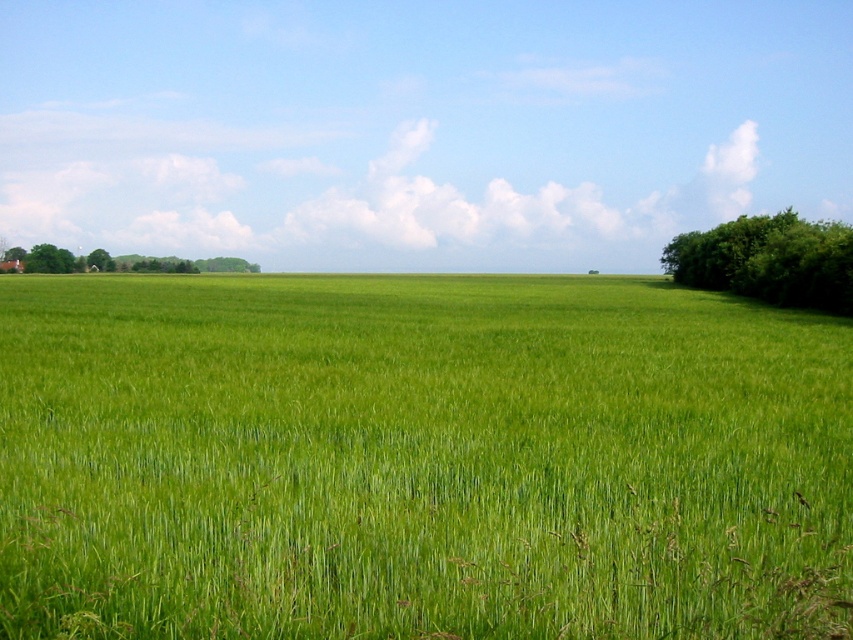
Question: Which point appears farthest from the camera in this image?

Choices:
 (A) (762, 253)
 (B) (242, 388)
 (C) (99, 266)
 (D) (44, 268)

Answer: (C)

Question: Which point is farther to the camera?

Choices:
 (A) green grassy field at center
 (B) green leafy tree at left

Answer: (A)

Question: Is green grass at center thinner than green leafy tree at left?

Choices:
 (A) no
 (B) yes

Answer: (A)

Question: Does green grass at center appear over green leafy trees at left?

Choices:
 (A) no
 (B) yes

Answer: (A)

Question: Is green grass at center thinner than green leafy tree at right?

Choices:
 (A) no
 (B) yes

Answer: (A)

Question: Which point is farther to the camera?

Choices:
 (A) green grass at center
 (B) green leafy trees at left

Answer: (B)